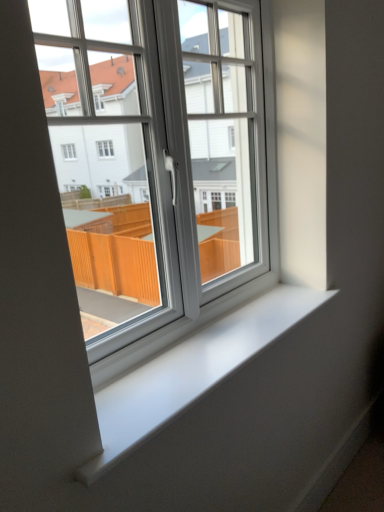
Question: Should I look upward or downward to see white plastic window at center?

Choices:
 (A) down
 (B) up

Answer: (B)

Question: From a real-world perspective, is white smooth window sill at center physically below white plastic window at center?

Choices:
 (A) no
 (B) yes

Answer: (B)

Question: Is white smooth window sill at center oriented away from white plastic window at center?

Choices:
 (A) no
 (B) yes

Answer: (A)

Question: Can you confirm if white smooth window sill at center is wider than white plastic window at center?

Choices:
 (A) no
 (B) yes

Answer: (B)

Question: Is white smooth window sill at center further to camera compared to white plastic window at center?

Choices:
 (A) no
 (B) yes

Answer: (B)

Question: From the image's perspective, does white smooth window sill at center appear higher than white plastic window at center?

Choices:
 (A) no
 (B) yes

Answer: (A)

Question: Is white smooth window sill at center shorter than white plastic window at center?

Choices:
 (A) yes
 (B) no

Answer: (A)

Question: Is white plastic window at center to the left of white smooth window sill at center from the viewer's perspective?

Choices:
 (A) no
 (B) yes

Answer: (B)

Question: Considering the relative sizes of white plastic window at center and white smooth window sill at center in the image provided, is white plastic window at center wider than white smooth window sill at center?

Choices:
 (A) yes
 (B) no

Answer: (B)

Question: Is white plastic window at center not near white smooth window sill at center?

Choices:
 (A) yes
 (B) no

Answer: (B)

Question: From the image's perspective, is white plastic window at center located above white smooth window sill at center?

Choices:
 (A) no
 (B) yes

Answer: (B)

Question: Is white plastic window at center not inside white smooth window sill at center?

Choices:
 (A) yes
 (B) no

Answer: (A)

Question: Is white plastic window at center in contact with white smooth window sill at center?

Choices:
 (A) yes
 (B) no

Answer: (B)

Question: From the image's perspective, is white plastic window at center positioned above or below white smooth window sill at center?

Choices:
 (A) below
 (B) above

Answer: (B)